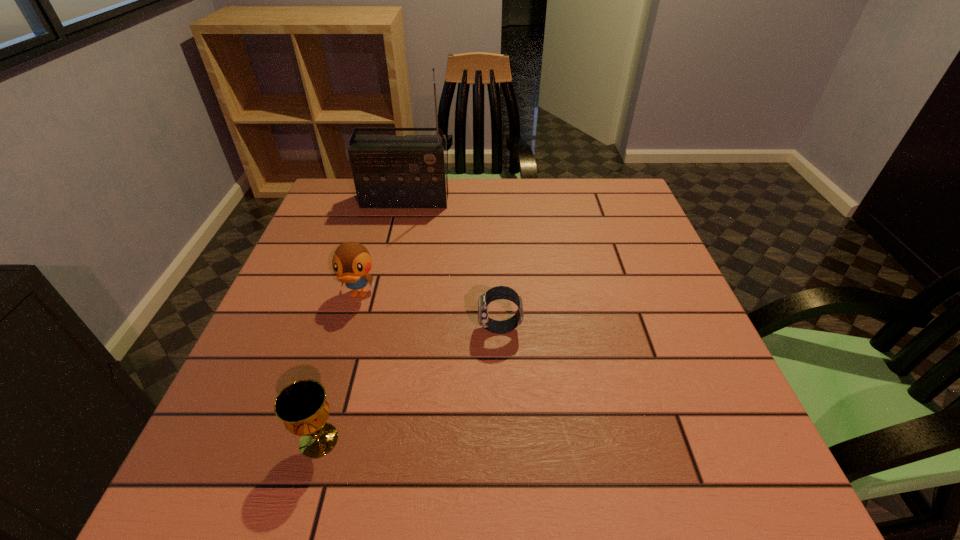
What are the coordinates of `vacant position in the image that satisfies the following two spatial constraints: 1. on the front-facing side of the nearest object; 2. on the right side of the duck` in the screenshot? It's located at (316, 440).

Identify the location of vacant space that satisfies the following two spatial constraints: 1. on the front-facing side of the duck; 2. on the right side of the nearest object. (316, 440).